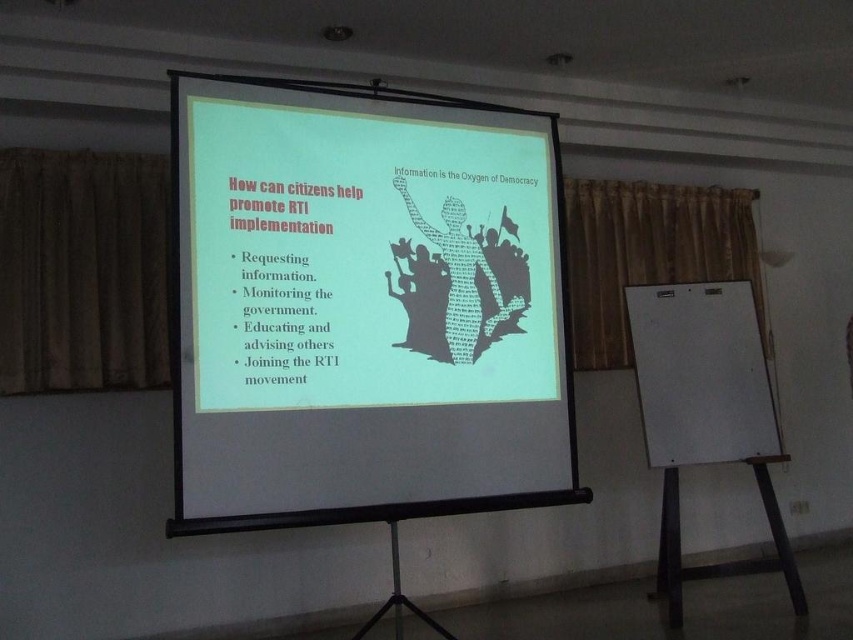
You are standing in the room and want to ensure that your presentation slides displayed on the white matte projection screen at center are visible to everyone in the room. Considering the room layout described, where should you position yourself to best view the screen and ensure the audience can see it clearly?

The white matte projection screen at center is located at point (x=363, y=307), so you should position yourself facing the screen from the front, ensuring that the audience seated in front of the screen has an unobstructed view. The white walls and beige curtains help reflect light, so maintaining the current artificial lighting should suffice for visibility.

You are a presenter who needs to move from the white matte projection screen at center to the white matte easel at right to write on it. You have a 1.2 meter long pointer in your hand. Can you safely walk between them without the pointer hitting anything?

The distance between the white matte projection screen at center and the white matte easel at right is 1.42 meters. Since the pointer is 1.2 meters long, which is shorter than the distance between them, you can safely walk between them without the pointer hitting anything.